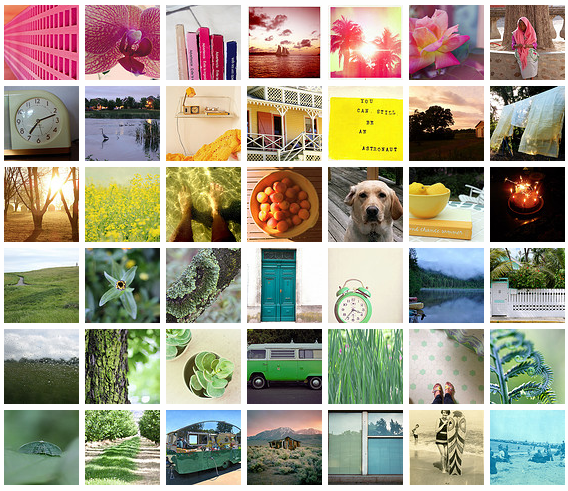
This screenshot has height=491, width=568. What are the coordinates of `left row of photographs` in the screenshot? It's located at (41, 43), (43, 121), (43, 201), (39, 279), (40, 361), (40, 435).